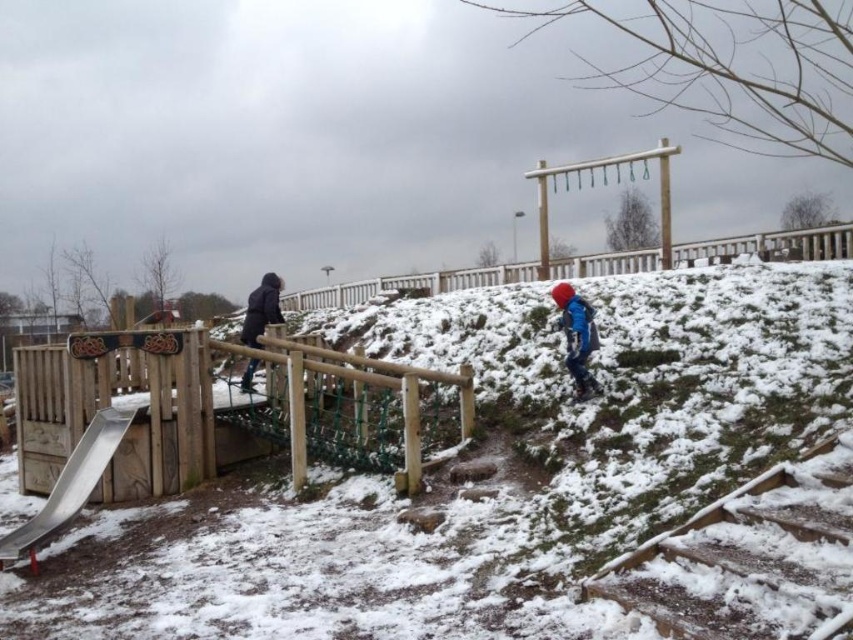
How much distance is there between metallic smooth slide at lower left and dark blue jacket at left?

metallic smooth slide at lower left and dark blue jacket at left are 9.02 feet apart from each other.

From the picture: Can you confirm if metallic smooth slide at lower left is wider than dark blue jacket at left?

No, metallic smooth slide at lower left is not wider than dark blue jacket at left.

Is point (120, 426) positioned after point (265, 320)?

No, it is in front of (265, 320).

Where is `metallic smooth slide at lower left`? metallic smooth slide at lower left is located at coordinates (68, 486).

Is point (595, 384) less distant than point (247, 314)?

Yes.

Is point (578, 369) less distant than point (250, 340)?

Yes.

The width and height of the screenshot is (853, 640). What are the coordinates of `blue fabric jacket at center` in the screenshot? It's located at (576, 336).

Can you confirm if wooden stairs at lower right is bigger than dark blue jacket at left?

No.

What do you see at coordinates (751, 557) in the screenshot? I see `wooden stairs at lower right` at bounding box center [751, 557].

You are a GUI agent. You are given a task and a screenshot of the screen. Output one action in this format:
    pyautogui.click(x=<x>, y=<y>)
    Task: Click on the wooden stairs at lower right
    
    Given the screenshot: What is the action you would take?
    pyautogui.click(x=751, y=557)

I want to click on wooden stairs at lower right, so click(751, 557).